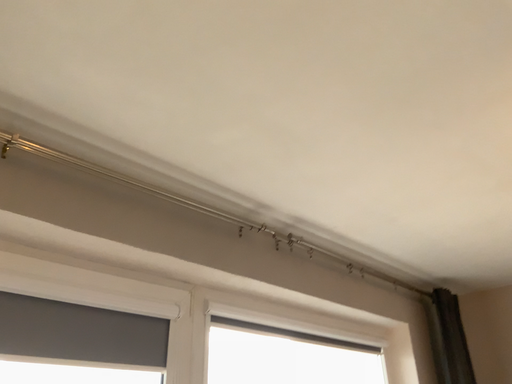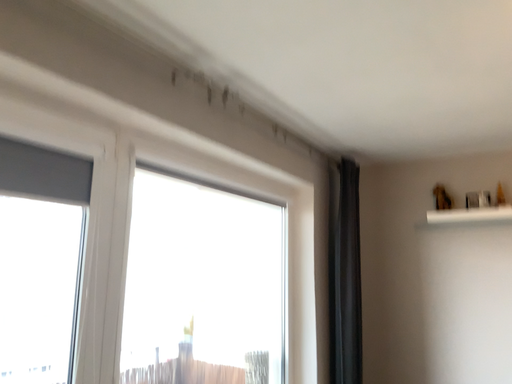
Question: How did the camera likely rotate when shooting the video?

Choices:
 (A) rotated right
 (B) rotated left

Answer: (A)